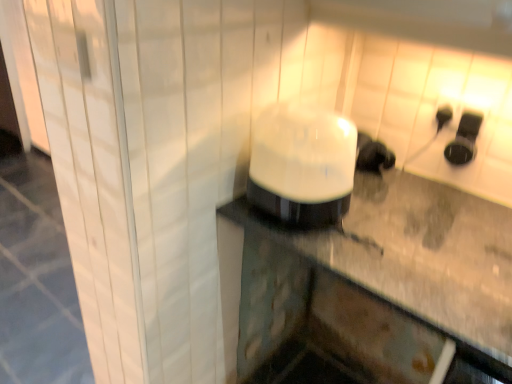
Question: Can you confirm if white glossy humidifier at center, marked as the first appliance in a left-to-right arrangement, is taller than black rubber earbuds at upper right, the first appliance viewed from the right?

Choices:
 (A) yes
 (B) no

Answer: (A)

Question: Is the surface of white glossy humidifier at center, which is counted as the 1th appliance, starting from the front, in direct contact with black rubber earbuds at upper right, which is the 1th appliance from back to front?

Choices:
 (A) no
 (B) yes

Answer: (A)

Question: Can you confirm if white glossy humidifier at center, which is counted as the 1th appliance, starting from the front, is thinner than black rubber earbuds at upper right, marked as the 2th appliance in a left-to-right arrangement?

Choices:
 (A) yes
 (B) no

Answer: (B)

Question: From a real-world perspective, is white glossy humidifier at center, marked as the first appliance in a left-to-right arrangement, positioned under black rubber earbuds at upper right, the first appliance viewed from the right, based on gravity?

Choices:
 (A) no
 (B) yes

Answer: (B)

Question: Would you say white glossy humidifier at center, placed as the 2th appliance when sorted from right to left, is outside black rubber earbuds at upper right, the first appliance viewed from the right?

Choices:
 (A) yes
 (B) no

Answer: (A)

Question: Based on their sizes in the image, would you say white glossy humidifier at center, marked as the first appliance in a left-to-right arrangement, is bigger or smaller than black rubber earbuds at upper right, marked as the 2th appliance in a left-to-right arrangement?

Choices:
 (A) big
 (B) small

Answer: (A)

Question: Is white glossy humidifier at center, placed as the 2th appliance when sorted from right to left, to the left or to the right of black rubber earbuds at upper right, the first appliance viewed from the right, in the image?

Choices:
 (A) right
 (B) left

Answer: (B)

Question: Is point (270, 110) positioned closer to the camera than point (474, 145)?

Choices:
 (A) closer
 (B) farther

Answer: (A)

Question: Considering the positions of white glossy humidifier at center, placed as the 2th appliance when sorted from right to left, and black rubber earbuds at upper right, marked as the 2th appliance in a left-to-right arrangement, in the image, is white glossy humidifier at center, placed as the 2th appliance when sorted from right to left, taller or shorter than black rubber earbuds at upper right, marked as the 2th appliance in a left-to-right arrangement,?

Choices:
 (A) tall
 (B) short

Answer: (A)

Question: Considering their positions, is white glossy humidifier at center, placed as the 2th appliance when sorted from right to left, located in front of or behind black plastic outlet at upper right?

Choices:
 (A) front
 (B) behind

Answer: (A)

Question: Does point (278, 110) appear closer or farther from the camera than point (437, 125)?

Choices:
 (A) closer
 (B) farther

Answer: (A)

Question: Looking at the image, does white glossy humidifier at center, which is counted as the 1th appliance, starting from the front, seem bigger or smaller compared to black plastic outlet at upper right?

Choices:
 (A) small
 (B) big

Answer: (B)

Question: In the image, is white glossy humidifier at center, placed as the 2th appliance when sorted from right to left, on the left side or the right side of black plastic outlet at upper right?

Choices:
 (A) right
 (B) left

Answer: (B)

Question: Considering the positions of point (448, 160) and point (442, 124), is point (448, 160) closer or farther from the camera than point (442, 124)?

Choices:
 (A) closer
 (B) farther

Answer: (A)

Question: From a real-world perspective, relative to black plastic outlet at upper right, is black rubber earbuds at upper right, the first appliance viewed from the right, vertically above or below?

Choices:
 (A) above
 (B) below

Answer: (B)